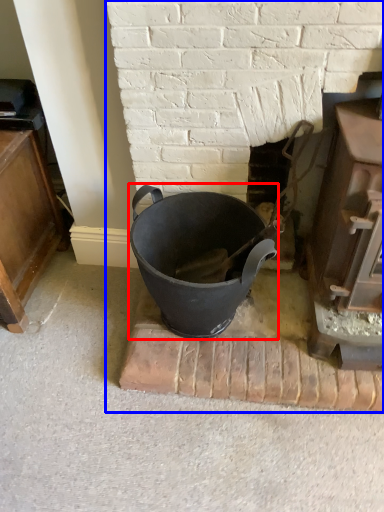
Question: Among these objects, which one is nearest to the camera, crock pot (highlighted by a red box) or fireplace (highlighted by a blue box)?

Choices:
 (A) crock pot
 (B) fireplace

Answer: (B)